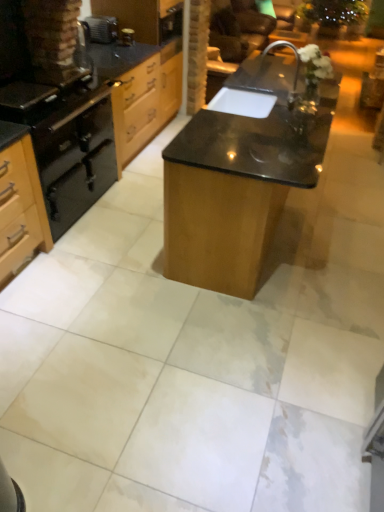
You are a GUI agent. You are given a task and a screenshot of the screen. Output one action in this format:
    pyautogui.click(x=<x>, y=<y>)
    Task: Click on the unoccupied area in front of metallic canister at upper center, positioned as the second appliance in left-to-right order
    Image resolution: width=384 pixels, height=512 pixels.
    Given the screenshot: What is the action you would take?
    pyautogui.click(x=118, y=51)